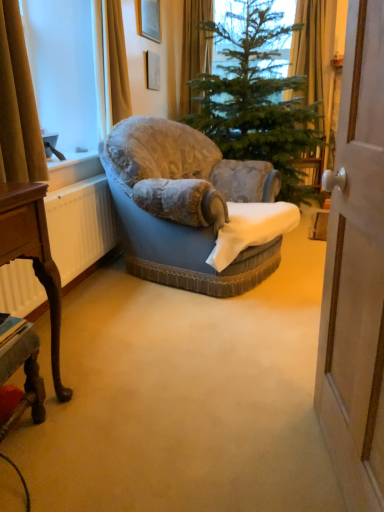
In order to click on free spot in front of velvet blue armchair at center in this screenshot , I will do `click(185, 334)`.